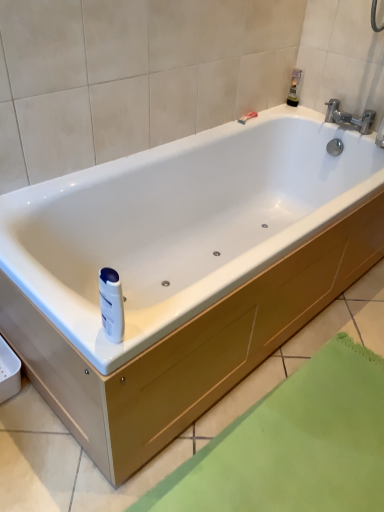
Describe the element at coordinates (111, 304) in the screenshot. I see `white plastic bottle at center, which is the second toiletry in back-to-front order` at that location.

Locate an element on the screen. silver metallic faucet at upper right is located at coordinates [349, 117].

You are a GUI agent. You are given a task and a screenshot of the screen. Output one action in this format:
    pyautogui.click(x=<x>, y=<y>)
    Task: Click on the matte plastic razor at upper right
    The height and width of the screenshot is (512, 384).
    Given the screenshot: What is the action you would take?
    pyautogui.click(x=247, y=117)

Find the location of a particular element. This screenshot has height=512, width=384. translucent plastic bottle at upper right, which is the 1th toiletry from back to front is located at coordinates (295, 87).

Based on the photo, which object is positioned more to the right, matte plastic razor at upper right or silver metallic faucet at upper right?

silver metallic faucet at upper right is more to the right.

Is matte plastic razor at upper right facing towards silver metallic faucet at upper right?

Yes.

Which is nearer, (244, 120) or (352, 125)?

The point (244, 120) is in front.

Does matte plastic razor at upper right have a lesser width compared to silver metallic faucet at upper right?

Yes, matte plastic razor at upper right is thinner than silver metallic faucet at upper right.

Consider the image. From a real-world perspective, which is physically above, matte plastic razor at upper right or white plastic bottle at center, which is the 2th toiletry from right to left?

From a 3D spatial view, white plastic bottle at center, which is the 2th toiletry from right to left, is above.

Can you tell me how much matte plastic razor at upper right and white plastic bottle at center, the first toiletry viewed from the front, differ in facing direction?

2.17 degrees separate the facing orientations of matte plastic razor at upper right and white plastic bottle at center, the first toiletry viewed from the front.

Which object is wider, matte plastic razor at upper right or white plastic bottle at center, arranged as the first toiletry when viewed from the left?

With larger width is white plastic bottle at center, arranged as the first toiletry when viewed from the left.

Can you confirm if matte plastic razor at upper right is smaller than white plastic bottle at center, arranged as the first toiletry when viewed from the left?

Yes, matte plastic razor at upper right is smaller than white plastic bottle at center, arranged as the first toiletry when viewed from the left.

Can you tell me how much translucent plastic bottle at upper right, arranged as the 1th toiletry when viewed from the top, and white plastic bottle at center, which is the 2th toiletry from right to left, differ in facing direction?

There is a 0.729-degree angle between the facing directions of translucent plastic bottle at upper right, arranged as the 1th toiletry when viewed from the top, and white plastic bottle at center, which is the 2th toiletry from right to left.

Looking at this image, would you say translucent plastic bottle at upper right, arranged as the second toiletry when viewed from the front, is outside white plastic bottle at center, the first toiletry viewed from the front?

Yes, translucent plastic bottle at upper right, arranged as the second toiletry when viewed from the front, is not within white plastic bottle at center, the first toiletry viewed from the front.

Which object is positioned more to the right, translucent plastic bottle at upper right, the first toiletry in the right-to-left sequence, or white plastic bottle at center, the first toiletry viewed from the front?

translucent plastic bottle at upper right, the first toiletry in the right-to-left sequence, is more to the right.

Considering the relative sizes of translucent plastic bottle at upper right, arranged as the second toiletry when viewed from the front, and white plastic bottle at center, which is the 2th toiletry from right to left, in the image provided, is translucent plastic bottle at upper right, arranged as the second toiletry when viewed from the front, wider than white plastic bottle at center, which is the 2th toiletry from right to left,?

No, translucent plastic bottle at upper right, arranged as the second toiletry when viewed from the front, is not wider than white plastic bottle at center, which is the 2th toiletry from right to left.

Is silver metallic faucet at upper right positioned behind matte plastic razor at upper right?

That is False.

Is silver metallic faucet at upper right oriented away from matte plastic razor at upper right?

silver metallic faucet at upper right does not have its back to matte plastic razor at upper right.

From the image's perspective, is silver metallic faucet at upper right below matte plastic razor at upper right?

Yes.

Which object is positioned more to the left, silver metallic faucet at upper right or matte plastic razor at upper right?

Positioned to the left is matte plastic razor at upper right.

Considering the relative sizes of white plastic bottle at center, the first toiletry viewed from the front, and silver metallic faucet at upper right in the image provided, is white plastic bottle at center, the first toiletry viewed from the front, bigger than silver metallic faucet at upper right?

Actually, white plastic bottle at center, the first toiletry viewed from the front, might be smaller than silver metallic faucet at upper right.

From the image's perspective, which is above, white plastic bottle at center, acting as the 1th toiletry starting from the bottom, or silver metallic faucet at upper right?

silver metallic faucet at upper right is shown above in the image.

Considering the sizes of objects white plastic bottle at center, arranged as the first toiletry when viewed from the left, and silver metallic faucet at upper right in the image provided, who is taller, white plastic bottle at center, arranged as the first toiletry when viewed from the left, or silver metallic faucet at upper right?

With more height is white plastic bottle at center, arranged as the first toiletry when viewed from the left.

Is white plastic bottle at center, which is the second toiletry in back-to-front order, aimed at silver metallic faucet at upper right?

No, white plastic bottle at center, which is the second toiletry in back-to-front order, is not oriented towards silver metallic faucet at upper right.

Considering the positions of objects white plastic bottle at center, which is the 2th toiletry from top to bottom, and translucent plastic bottle at upper right, arranged as the 1th toiletry when viewed from the top, in the image provided, who is in front, white plastic bottle at center, which is the 2th toiletry from top to bottom, or translucent plastic bottle at upper right, arranged as the 1th toiletry when viewed from the top,?

white plastic bottle at center, which is the 2th toiletry from top to bottom.

In order to click on toiletry that is on the right side of white plastic bottle at center, which is the 2th toiletry from right to left in this screenshot , I will do point(295,87).

Between point (102, 319) and point (293, 96), which one is positioned in front?

The point (102, 319) is closer.

Is translucent plastic bottle at upper right, the first toiletry in the right-to-left sequence, surrounded by white plastic bottle at center, which is the second toiletry in back-to-front order?

That's incorrect, translucent plastic bottle at upper right, the first toiletry in the right-to-left sequence, is not inside white plastic bottle at center, which is the second toiletry in back-to-front order.

Does translucent plastic bottle at upper right, arranged as the second toiletry when viewed from the front, contain matte plastic razor at upper right?

No, matte plastic razor at upper right is not inside translucent plastic bottle at upper right, arranged as the second toiletry when viewed from the front.

Looking at this image, is translucent plastic bottle at upper right, the second toiletry positioned from the left, looking in the opposite direction of matte plastic razor at upper right?

translucent plastic bottle at upper right, the second toiletry positioned from the left, does not have its back to matte plastic razor at upper right.

Between translucent plastic bottle at upper right, which is the 1th toiletry from back to front, and matte plastic razor at upper right, which one has larger width?

translucent plastic bottle at upper right, which is the 1th toiletry from back to front, is wider.

This screenshot has height=512, width=384. I want to click on shower above the silver metallic faucet at upper right (from the image's perspective), so click(x=247, y=117).

Where is `shower on the right side of white plastic bottle at center, which is the second toiletry in back-to-front order`? shower on the right side of white plastic bottle at center, which is the second toiletry in back-to-front order is located at coordinates (247, 117).

Considering their positions, is white plastic bottle at center, which is the 2th toiletry from right to left, positioned closer to silver metallic faucet at upper right than matte plastic razor at upper right?

Among the two, matte plastic razor at upper right is located nearer to silver metallic faucet at upper right.

Based on their spatial positions, is matte plastic razor at upper right or translucent plastic bottle at upper right, the second toiletry positioned from the left, further from silver metallic faucet at upper right?

The object further to silver metallic faucet at upper right is matte plastic razor at upper right.

Looking at the image, which one is located closer to silver metallic faucet at upper right, translucent plastic bottle at upper right, marked as the second toiletry in a bottom-to-top arrangement, or matte plastic razor at upper right?

translucent plastic bottle at upper right, marked as the second toiletry in a bottom-to-top arrangement.

Estimate the real-world distances between objects in this image. Which object is further from matte plastic razor at upper right, translucent plastic bottle at upper right, marked as the second toiletry in a bottom-to-top arrangement, or silver metallic faucet at upper right?

silver metallic faucet at upper right.

Which object lies further to the anchor point matte plastic razor at upper right, silver metallic faucet at upper right or white plastic bottle at center, which is the second toiletry in back-to-front order?

white plastic bottle at center, which is the second toiletry in back-to-front order.

Estimate the real-world distances between objects in this image. Which object is closer to translucent plastic bottle at upper right, arranged as the 1th toiletry when viewed from the top, matte plastic razor at upper right or silver metallic faucet at upper right?

silver metallic faucet at upper right is closer to translucent plastic bottle at upper right, arranged as the 1th toiletry when viewed from the top.

Based on their spatial positions, is silver metallic faucet at upper right or matte plastic razor at upper right closer to white plastic bottle at center, which is the 2th toiletry from right to left?

Among the two, matte plastic razor at upper right is located nearer to white plastic bottle at center, which is the 2th toiletry from right to left.

When comparing their distances from white plastic bottle at center, which is the 2th toiletry from right to left, does translucent plastic bottle at upper right, the first toiletry in the right-to-left sequence, or silver metallic faucet at upper right seem closer?

silver metallic faucet at upper right is closer to white plastic bottle at center, which is the 2th toiletry from right to left.

The width and height of the screenshot is (384, 512). I want to click on toiletry located between matte plastic razor at upper right and silver metallic faucet at upper right in the left-right direction, so click(x=295, y=87).

Identify the location of tap between white plastic bottle at center, which is the 2th toiletry from top to bottom, and translucent plastic bottle at upper right, which is the 1th toiletry from back to front, along the z-axis. (349, 117).

I want to click on shower positioned between white plastic bottle at center, which is the 2th toiletry from top to bottom, and translucent plastic bottle at upper right, arranged as the 1th toiletry when viewed from the top, from near to far, so click(x=247, y=117).

This screenshot has width=384, height=512. I want to click on tap positioned between white plastic bottle at center, which is the 2th toiletry from top to bottom, and matte plastic razor at upper right from near to far, so (x=349, y=117).